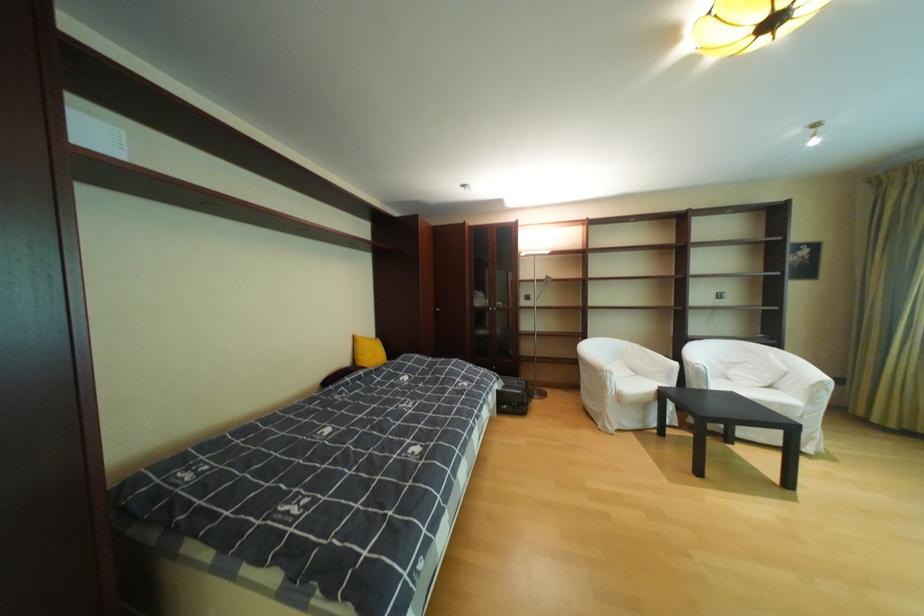
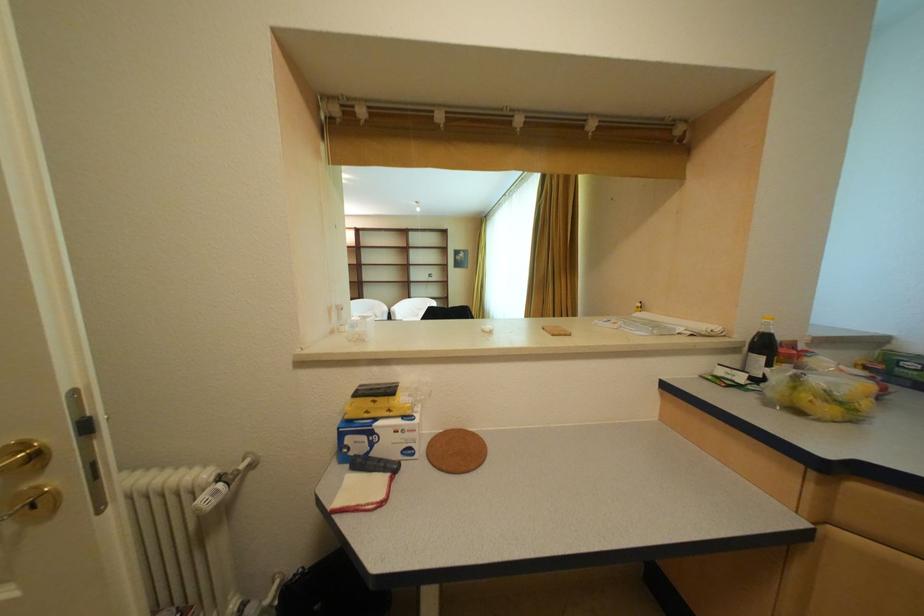
The images are taken continuously from a first-person perspective. In which direction are you moving?

The movement direction of the cameraman is right, backward.